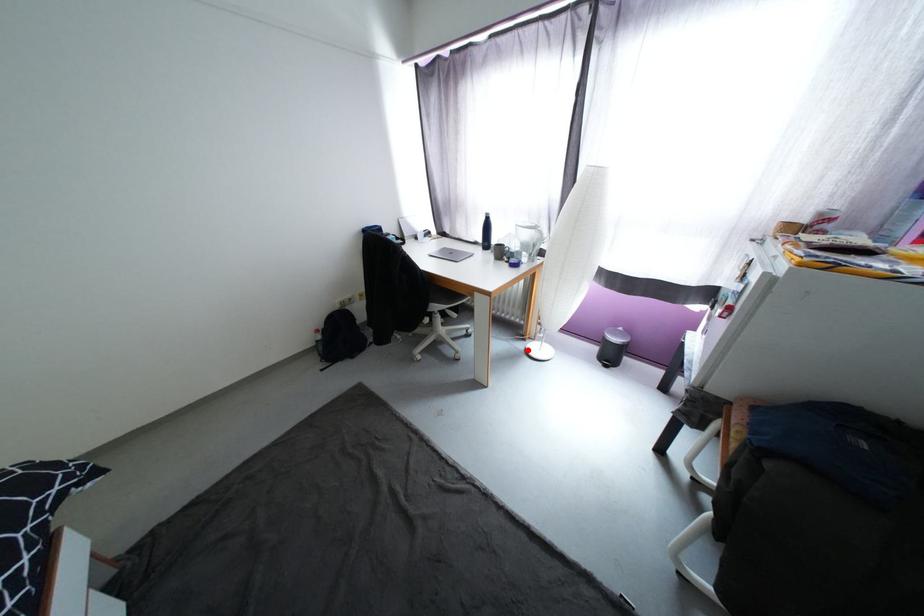
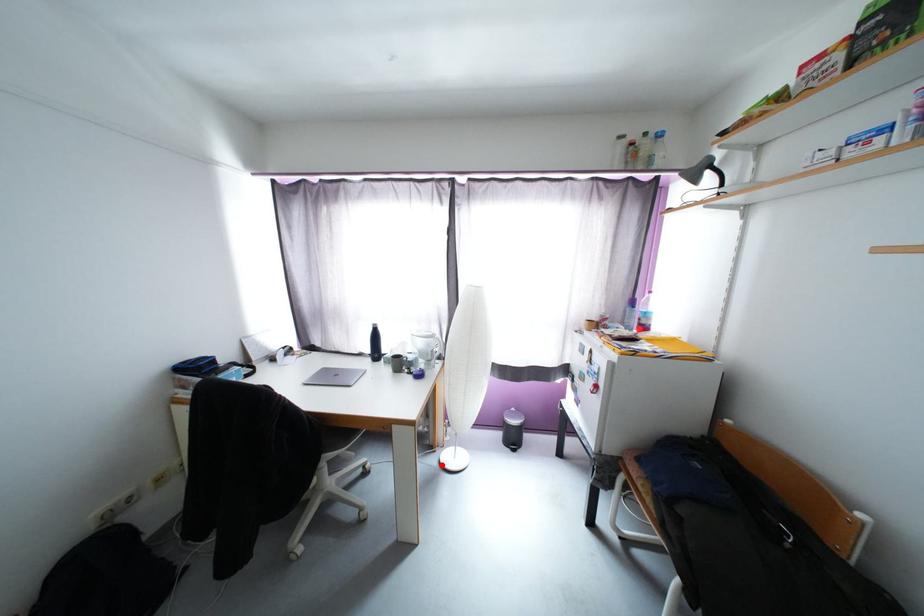
I am providing you with two images of the same scene from different viewpoints. A red point is marked on the first image and another point is marked on the second image. Is the red point in image1 aligned with the point shown in image2?

Yes